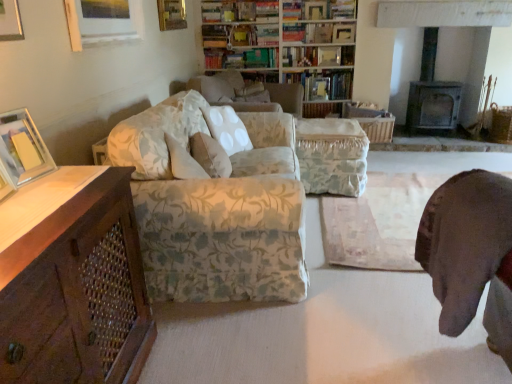
Locate an element on the screen. The height and width of the screenshot is (384, 512). wooden picture frame at upper left, the 2th picture frame when ordered from front to back is located at coordinates (102, 22).

Measure the distance between point (x=88, y=15) and camera.

7.55 feet.

The image size is (512, 384). What do you see at coordinates (241, 58) in the screenshot?
I see `hardcover books at upper center, which is the fourth book in top-to-bottom order` at bounding box center [241, 58].

Locate an element on the screen. This screenshot has height=384, width=512. hardcover book at upper center, the 5th book when ordered from bottom to top is located at coordinates (343, 9).

The width and height of the screenshot is (512, 384). Describe the element at coordinates (323, 84) in the screenshot. I see `hardcover book at upper center, which ranks as the first book in bottom-to-top order` at that location.

Measure the distance between matte glass picture frame at upper left, acting as the fourth picture frame starting from the back, and camera.

matte glass picture frame at upper left, acting as the fourth picture frame starting from the back, and camera are 1.41 meters apart from each other.

What do you see at coordinates (344, 33) in the screenshot? I see `wooden picture frame at upper center, which appears as the first picture frame when viewed from the back` at bounding box center [344, 33].

Identify the location of dark gray stone fireplace at upper right. The image size is (512, 384). (432, 94).

How much distance is there between hardcover books at upper center, which is the fourth book in top-to-bottom order, and hardcover book at upper center, the 5th book when ordered from bottom to top?

hardcover books at upper center, which is the fourth book in top-to-bottom order, is 3.30 feet away from hardcover book at upper center, the 5th book when ordered from bottom to top.

Based on their sizes in the image, would you say hardcover books at upper center, which is the fourth book in top-to-bottom order, is bigger or smaller than hardcover book at upper center, the 5th book when ordered from bottom to top?

hardcover books at upper center, which is the fourth book in top-to-bottom order, is bigger than hardcover book at upper center, the 5th book when ordered from bottom to top.

Which object is positioned more to the left, hardcover books at upper center, which ranks as the 2th book in bottom-to-top order, or hardcover book at upper center, the 5th book when ordered from bottom to top?

From the viewer's perspective, hardcover books at upper center, which ranks as the 2th book in bottom-to-top order, appears more on the left side.

Is hardcover book at upper center, the 5th book when ordered from bottom to top, further to camera compared to floral fabric ottoman at center?

Yes.

Would you say hardcover book at upper center, the 5th book when ordered from bottom to top, is outside floral fabric ottoman at center?

hardcover book at upper center, the 5th book when ordered from bottom to top, is positioned outside floral fabric ottoman at center.

Would you consider hardcover book at upper center, marked as the 1th book in a top-to-bottom arrangement, to be distant from floral fabric ottoman at center?

hardcover book at upper center, marked as the 1th book in a top-to-bottom arrangement, is far away from floral fabric ottoman at center.

Could you tell me if hardcover book at upper center, the 5th book when ordered from bottom to top, is turned towards floral fabric ottoman at center?

No, hardcover book at upper center, the 5th book when ordered from bottom to top, does not turn towards floral fabric ottoman at center.

Starting from the rusty metal grate at lower left, which book is the 1st one to the right? Please provide its 2D coordinates.

[(215, 36)]

From their relative heights in the image, would you say rusty metal grate at lower left is taller or shorter than hardcover book at upper center, placed as the 4th book when sorted from bottom to top?

Clearly, rusty metal grate at lower left is taller compared to hardcover book at upper center, placed as the 4th book when sorted from bottom to top.

Which is farther from the camera, [147,332] or [212,36]?

The point [212,36] is more distant.

Between rusty metal grate at lower left and hardcover book at upper center, placed as the 4th book when sorted from bottom to top, which one has larger width?

rusty metal grate at lower left.

Is hardcover book at upper center, which ranks as the first book in bottom-to-top order, oriented towards brown leather swivel chair at lower right?

Yes, hardcover book at upper center, which ranks as the first book in bottom-to-top order, is oriented towards brown leather swivel chair at lower right.

Is point (332, 75) closer or farther from the camera than point (506, 286)?

Clearly, point (332, 75) is more distant from the camera than point (506, 286).

Which object is closer to the camera, hardcover book at upper center, the 5th book in the top-to-bottom sequence, or brown leather swivel chair at lower right?

brown leather swivel chair at lower right is more forward.

Is hardcover book at upper center, the 5th book in the top-to-bottom sequence, shorter than brown leather swivel chair at lower right?

Correct, hardcover book at upper center, the 5th book in the top-to-bottom sequence, is not as tall as brown leather swivel chair at lower right.

Is brown leather swivel chair at lower right inside or outside of matte glass picture frame at upper left, marked as the third picture frame in a right-to-left arrangement?

brown leather swivel chair at lower right lies outside matte glass picture frame at upper left, marked as the third picture frame in a right-to-left arrangement.

From the image's perspective, would you say brown leather swivel chair at lower right is positioned over matte glass picture frame at upper left, marked as the third picture frame in a right-to-left arrangement?

No, from the image's perspective, brown leather swivel chair at lower right is not on top of matte glass picture frame at upper left, marked as the third picture frame in a right-to-left arrangement.

Does brown leather swivel chair at lower right lie behind matte glass picture frame at upper left, acting as the fourth picture frame starting from the back?

No.

Find the location of a particular element. The width and height of the screenshot is (512, 384). swivel chair on the right of matte glass picture frame at upper left, the first picture frame when ordered from front to back is located at coordinates (471, 254).

How different are the orientations of hardcover books at upper center, which ranks as the 2th book in bottom-to-top order, and matte glass picture frame at upper left, marked as the third picture frame in a right-to-left arrangement, in degrees?

The angle between the facing direction of hardcover books at upper center, which ranks as the 2th book in bottom-to-top order, and the facing direction of matte glass picture frame at upper left, marked as the third picture frame in a right-to-left arrangement, is 75.6 degrees.

Is hardcover books at upper center, which ranks as the 2th book in bottom-to-top order, facing away from matte glass picture frame at upper left, the 1th picture frame from the bottom?

hardcover books at upper center, which ranks as the 2th book in bottom-to-top order, is not turned away from matte glass picture frame at upper left, the 1th picture frame from the bottom.

What are the coordinates of `picture frame that is the 4th object located in front of the hardcover books at upper center, which ranks as the 2th book in bottom-to-top order` in the screenshot? It's located at (23, 148).

Which of these two, gold metallic picture frame at upper center, which is the 3th picture frame in front-to-back order, or floral fabric bookcase at upper center, stands taller?

Standing taller between the two is floral fabric bookcase at upper center.

Considering the positions of objects gold metallic picture frame at upper center, marked as the 3th picture frame in a bottom-to-top arrangement, and floral fabric bookcase at upper center in the image provided, who is more to the right, gold metallic picture frame at upper center, marked as the 3th picture frame in a bottom-to-top arrangement, or floral fabric bookcase at upper center?

floral fabric bookcase at upper center is more to the right.

What's the angular difference between gold metallic picture frame at upper center, which is the second picture frame from right to left, and floral fabric bookcase at upper center's facing directions?

The facing directions of gold metallic picture frame at upper center, which is the second picture frame from right to left, and floral fabric bookcase at upper center are 88.8 degrees apart.

Does gold metallic picture frame at upper center, which is the 3th picture frame in front-to-back order, have a lesser width compared to floral fabric bookcase at upper center?

Yes.

Where is `the 2nd book behind when counting from the hardcover book at upper center, the 5th book when ordered from bottom to top`? the 2nd book behind when counting from the hardcover book at upper center, the 5th book when ordered from bottom to top is located at coordinates (241, 58).

Find the location of `the footrest in front of the hardcover book at upper center, marked as the 1th book in a top-to-bottom arrangement`. the footrest in front of the hardcover book at upper center, marked as the 1th book in a top-to-bottom arrangement is located at coordinates (332, 156).

Estimate the real-world distances between objects in this image. Which object is closer to floral fabric ottoman at center, hardcover book at upper center, the second book from the top, or hardcover book at upper center, which ranks as the first book in bottom-to-top order?

Based on the image, hardcover book at upper center, which ranks as the first book in bottom-to-top order, appears to be nearer to floral fabric ottoman at center.

Estimate the real-world distances between objects in this image. Which object is closer to gold metallic picture frame at upper center, marked as the third picture frame in a left-to-right arrangement, hardcover books at upper center, which is the fourth book in top-to-bottom order, or dark gray stone fireplace at upper right?

hardcover books at upper center, which is the fourth book in top-to-bottom order.

Which object lies further to the anchor point floral fabric ottoman at center, floral fabric couch at center or rusty metal grate at lower left?

rusty metal grate at lower left is positioned further to the anchor floral fabric ottoman at center.

When comparing their distances from hardcover books at upper center, which is the fourth book in top-to-bottom order, does dark gray stone fireplace at upper right or hardcover book at upper center, the second book from the top, seem closer?

hardcover book at upper center, the second book from the top, lies closer to hardcover books at upper center, which is the fourth book in top-to-bottom order, than the other object.

Looking at the image, which one is located closer to hardcover books at upper center, which is the fourth book in top-to-bottom order, fluffy white pillow at center or floral fabric ottoman at center?

floral fabric ottoman at center is closer to hardcover books at upper center, which is the fourth book in top-to-bottom order.

When comparing their distances from dark gray stone fireplace at upper right, does hardcover book at upper center, the second book from the top, or wooden picture frame at upper center, the 4th picture frame viewed from the front, seem closer?

wooden picture frame at upper center, the 4th picture frame viewed from the front, lies closer to dark gray stone fireplace at upper right than the other object.

Estimate the real-world distances between objects in this image. Which object is closer to fluffy white pillow at center, wooden picture frame at upper left, which is the third picture frame in back-to-front order, or floral fabric bookcase at upper center?

wooden picture frame at upper left, which is the third picture frame in back-to-front order.

When comparing their distances from wooden picture frame at upper center, the first picture frame when ordered from top to bottom, does dark gray stone fireplace at upper right or rusty metal grate at lower left seem further?

Among the two, rusty metal grate at lower left is located further to wooden picture frame at upper center, the first picture frame when ordered from top to bottom.

Where is `the footrest positioned between rusty metal grate at lower left and hardcover book at upper center, marked as the 1th book in a top-to-bottom arrangement, from near to far`? The height and width of the screenshot is (384, 512). the footrest positioned between rusty metal grate at lower left and hardcover book at upper center, marked as the 1th book in a top-to-bottom arrangement, from near to far is located at coordinates 332,156.

Find the location of a particular element. footrest between matte glass picture frame at upper left, the 1th picture frame from the bottom, and hardcover book at upper center, placed as the 4th book when sorted from bottom to top, from front to back is located at coordinates (332, 156).

Identify the location of picture frame between matte glass picture frame at upper left, the 1th picture frame from the bottom, and gold metallic picture frame at upper center, the 2th picture frame positioned from the top, from front to back. The height and width of the screenshot is (384, 512). (102, 22).

The height and width of the screenshot is (384, 512). I want to click on footrest between floral fabric couch at center and dark gray stone fireplace at upper right from front to back, so click(332, 156).